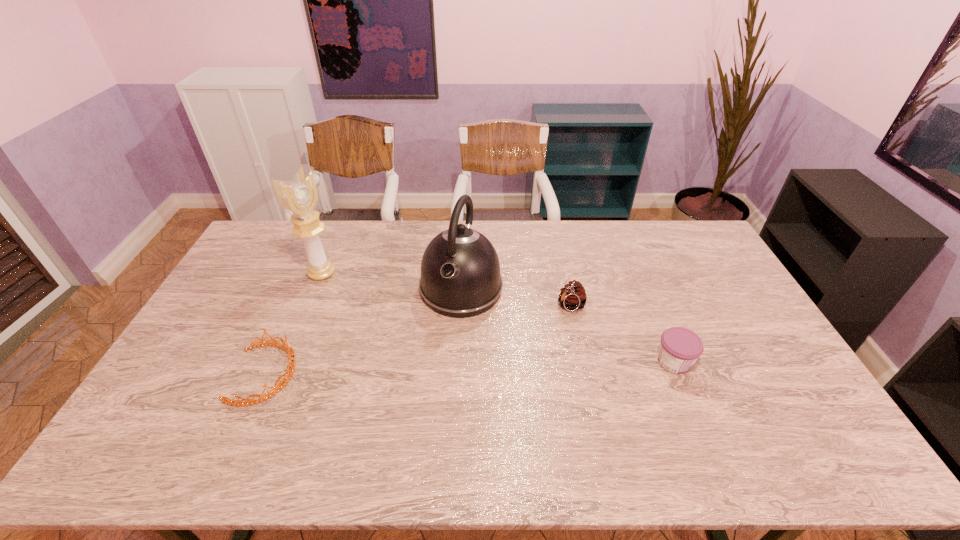
In the image, there is a desktop. Identify the location of vacant region at the left edge. (x=244, y=283).

Where is `vacant space at the right edge of the desktop`? vacant space at the right edge of the desktop is located at coordinates (780, 363).

Identify the location of free space at the near left corner of the desktop. (180, 416).

At what (x,y) coordinates should I click in order to perform the action: click on blank space at the far right corner of the desktop. Please return your answer as a coordinate pair (x, y). Image resolution: width=960 pixels, height=540 pixels. Looking at the image, I should click on (660, 221).

Where is `empty space between the award and the rightmost object`? The width and height of the screenshot is (960, 540). empty space between the award and the rightmost object is located at coordinates (498, 318).

The image size is (960, 540). What are the coordinates of `free spot between the second tallest object and the award` in the screenshot? It's located at (392, 281).

This screenshot has height=540, width=960. Find the location of `free space between the fourth object from left to right and the rightmost object`. free space between the fourth object from left to right and the rightmost object is located at coordinates (623, 334).

This screenshot has width=960, height=540. In order to click on free space between the award and the jam in this screenshot , I will do `click(498, 318)`.

Identify the location of blank region between the award and the tiara. (294, 323).

Locate an element on the screen. The height and width of the screenshot is (540, 960). unoccupied position between the tiara and the second object from right to left is located at coordinates (419, 340).